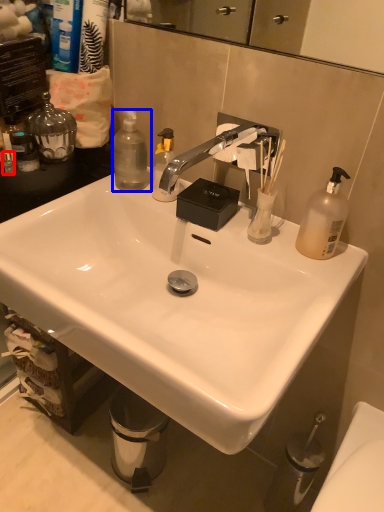
Question: Which point is further to the camera, toiletry (highlighted by a red box) or bottle (highlighted by a blue box)?

Choices:
 (A) toiletry
 (B) bottle

Answer: (B)